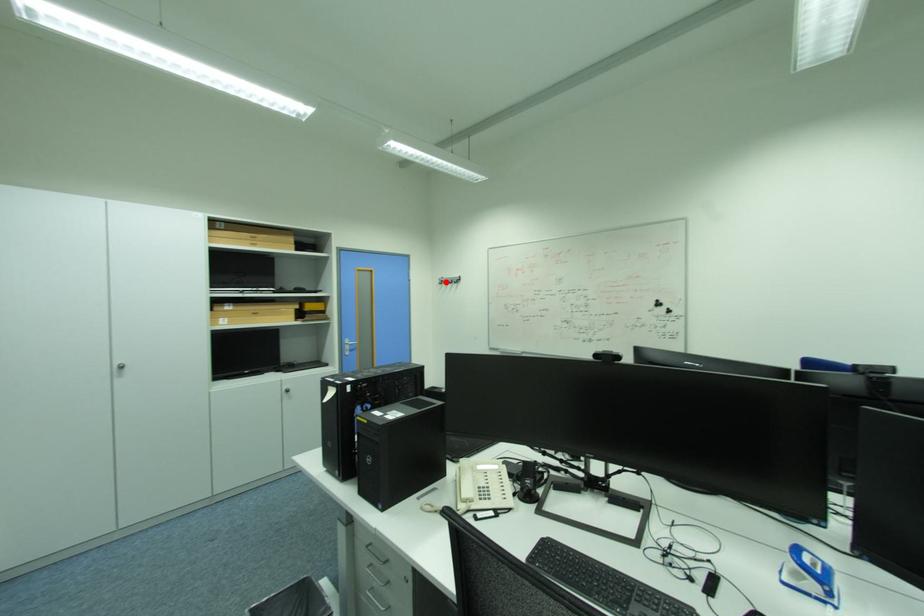
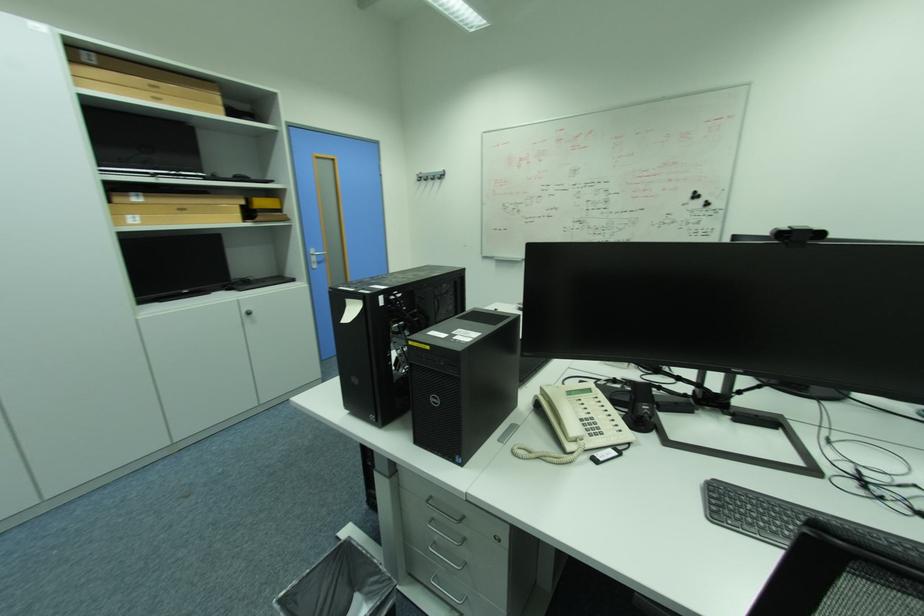
Find the pixel in the second image that matches the highlighted location in the first image.

(421, 179)